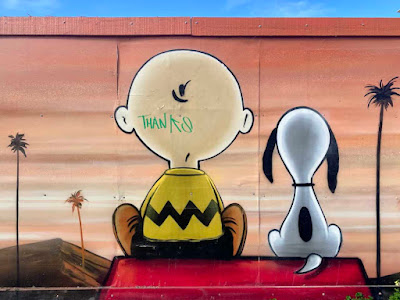
Identify the location of wall. The height and width of the screenshot is (300, 400). (84, 114).